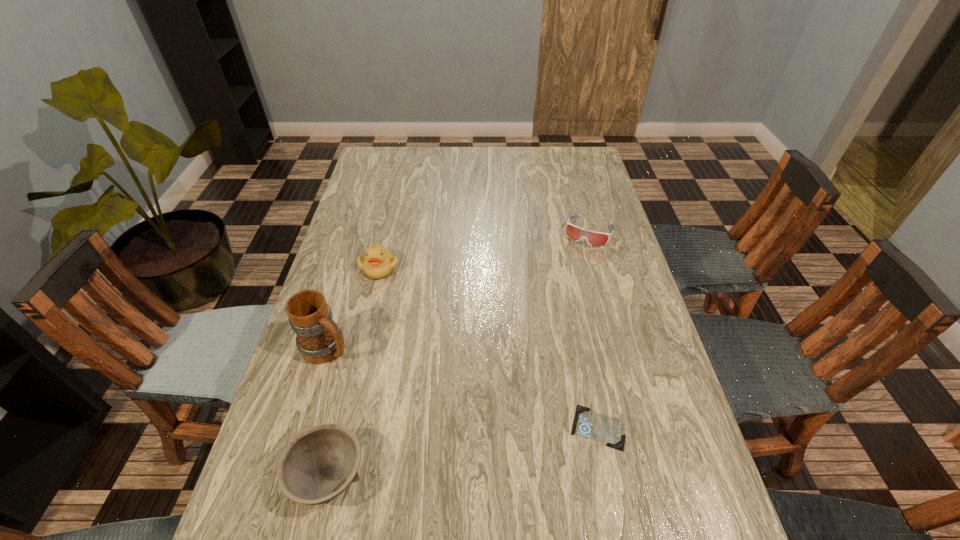
Locate an element on the screen. This screenshot has width=960, height=540. vacant space on the desktop that is between the bowl and the shortest object and is positioned on the side of the mug with the handle is located at coordinates (469, 451).

At what (x,y) coordinates should I click in order to perform the action: click on free space on the desktop that is between the third shortest object and the identity card and is positioned on the beak of the second tallest object. Please return your answer as a coordinate pair (x, y). The width and height of the screenshot is (960, 540). Looking at the image, I should click on (481, 449).

In order to click on vacant spot on the desktop that is between the third tallest object and the shortest object and is positioned on the front-facing side of the goggles in this screenshot , I will do `click(487, 448)`.